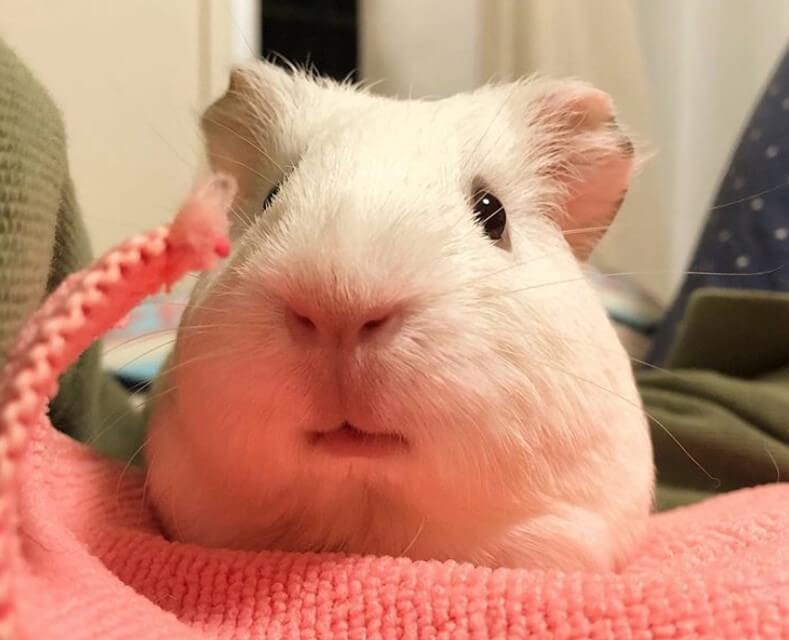
Identify the location of curtain. (656, 166).